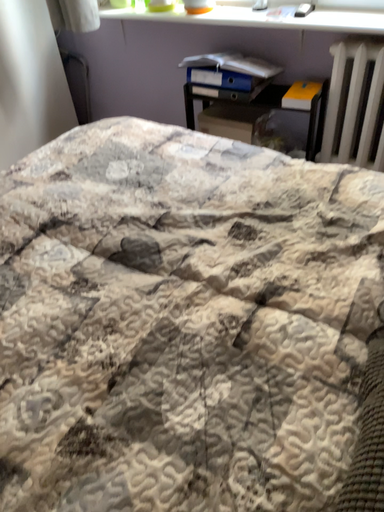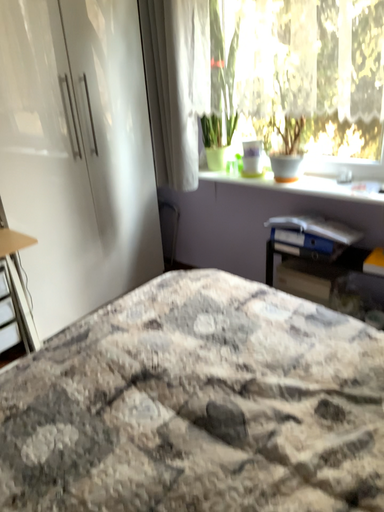
Question: Which way did the camera rotate in the video?

Choices:
 (A) rotated left
 (B) rotated right

Answer: (A)